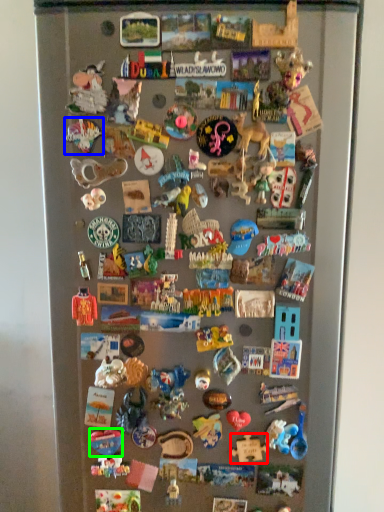
Question: Which object is positioned closest to toy (highlighted by a red box)? Select from toy (highlighted by a blue box) and toy (highlighted by a green box).

Choices:
 (A) toy
 (B) toy

Answer: (B)